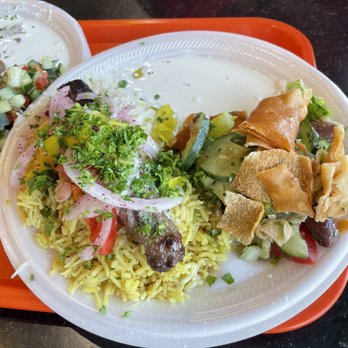
In order to click on plastic tray in this screenshot , I will do `click(111, 35)`.